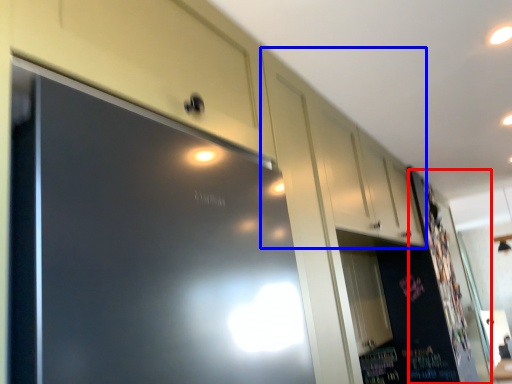
Question: Which object is further to the camera taking this photo, bulletin board (highlighted by a red box) or cabinetry (highlighted by a blue box)?

Choices:
 (A) bulletin board
 (B) cabinetry

Answer: (A)